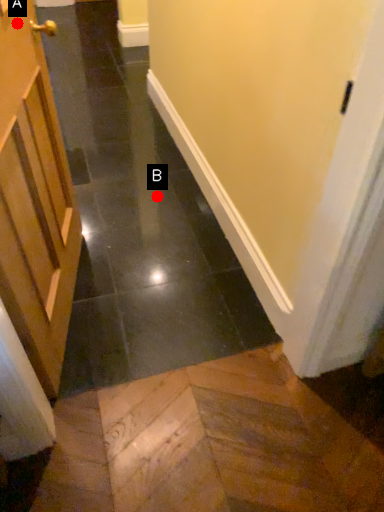
Question: Two points are circled on the image, labeled by A and B beside each circle. Which point is closer to the camera taking this photo?

Choices:
 (A) A is closer
 (B) B is closer

Answer: (A)